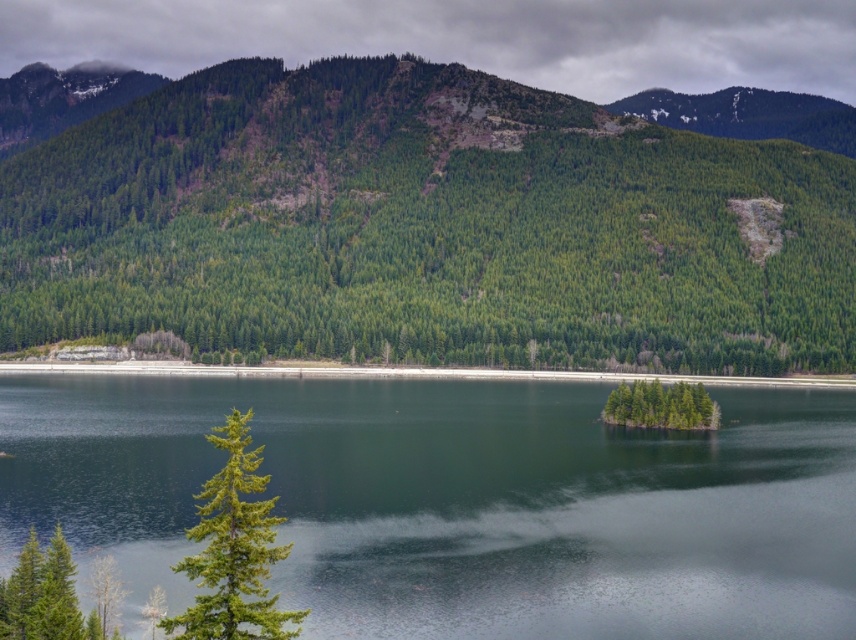
Question: Which is nearer to the green matte island at center?

Choices:
 (A) green textured pine tree at lower left
 (B) green matte tree at center

Answer: (A)

Question: Estimate the real-world distances between objects in this image. Which object is closer to the green smooth water at center?

Choices:
 (A) green matte tree at center
 (B) green textured pine tree at lower left

Answer: (B)

Question: Observing the image, what is the correct spatial positioning of green smooth water at center in reference to green matte island at center?

Choices:
 (A) above
 (B) below

Answer: (B)

Question: Is green matte tree at center closer to camera compared to green textured pine tree at lower left?

Choices:
 (A) yes
 (B) no

Answer: (B)

Question: Is green matte tree at center above green matte island at center?

Choices:
 (A) yes
 (B) no

Answer: (A)

Question: Which of the following is the closest to the observer?

Choices:
 (A) (159, 387)
 (B) (349, 276)
 (C) (634, 403)
 (D) (233, 474)

Answer: (D)